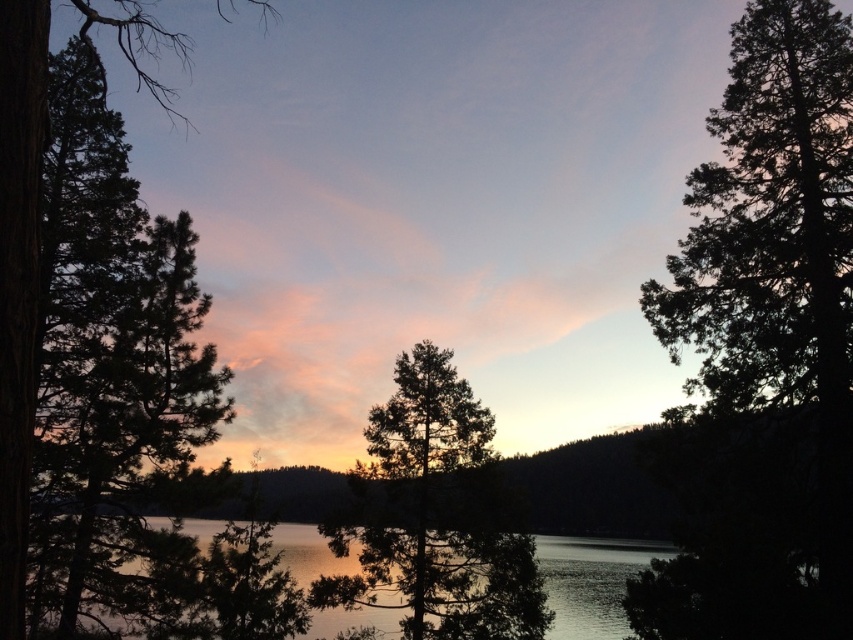
Question: Which point is farther from the camera taking this photo?

Choices:
 (A) (15, 636)
 (B) (442, 554)

Answer: (B)

Question: Does green textured tree at center appear over green textured pine tree at left?

Choices:
 (A) no
 (B) yes

Answer: (A)

Question: Which object is farther from the camera taking this photo?

Choices:
 (A) dark green textured tree at right
 (B) green textured pine tree at left

Answer: (A)

Question: Considering the relative positions of green textured tree at center and green textured pine tree at left in the image provided, where is green textured tree at center located with respect to green textured pine tree at left?

Choices:
 (A) above
 (B) below

Answer: (B)

Question: Does green textured tree at center appear on the left side of green textured pine tree at left?

Choices:
 (A) yes
 (B) no

Answer: (B)

Question: Among these points, which one is farthest from the camera?

Choices:
 (A) (724, 292)
 (B) (590, 604)

Answer: (B)